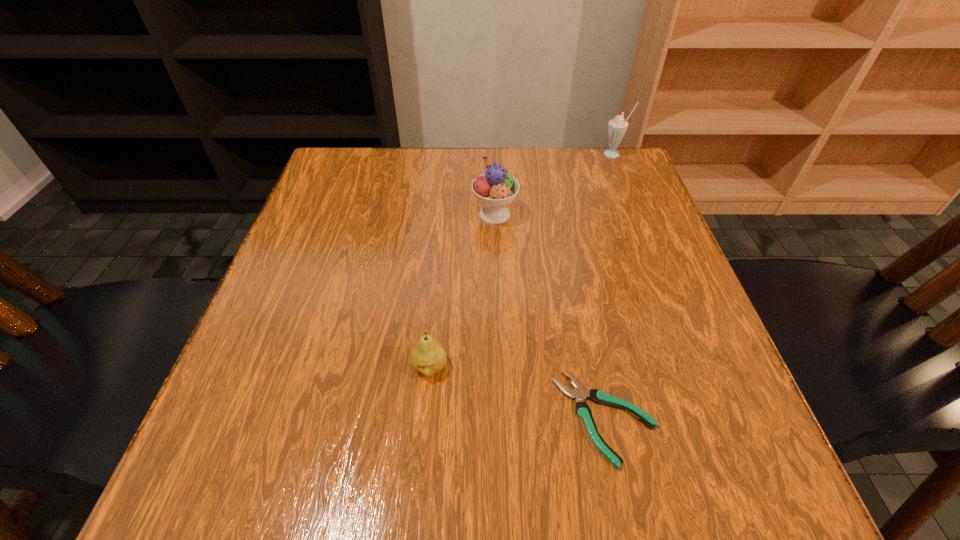
At what (x,y) coordinates should I click in order to perform the action: click on the farthest object. Please return your answer as a coordinate pair (x, y). The width and height of the screenshot is (960, 540). Looking at the image, I should click on (617, 127).

This screenshot has height=540, width=960. Identify the location of milkshake. (617, 127).

At what (x,y) coordinates should I click in order to perform the action: click on icecream. Please return your answer as a coordinate pair (x, y). This screenshot has height=540, width=960. Looking at the image, I should click on (496, 189).

The width and height of the screenshot is (960, 540). In order to click on the second farthest object in this screenshot , I will do `click(496, 189)`.

You are a GUI agent. You are given a task and a screenshot of the screen. Output one action in this format:
    pyautogui.click(x=<x>, y=<y>)
    Task: Click on the pear
    
    Given the screenshot: What is the action you would take?
    pyautogui.click(x=428, y=357)

Find the location of a particular element. Image resolution: width=960 pixels, height=540 pixels. the leftmost object is located at coordinates (428, 357).

The width and height of the screenshot is (960, 540). I want to click on the second object from right to left, so click(x=582, y=409).

Identify the location of pliers. The width and height of the screenshot is (960, 540). (582, 409).

Find the location of a particular element. vacant point located 0.220m on the straw side of the milkshake is located at coordinates (637, 211).

Locate an element on the screen. This screenshot has width=960, height=540. free space located 0.080m on the front of the third nearest object is located at coordinates [496, 254].